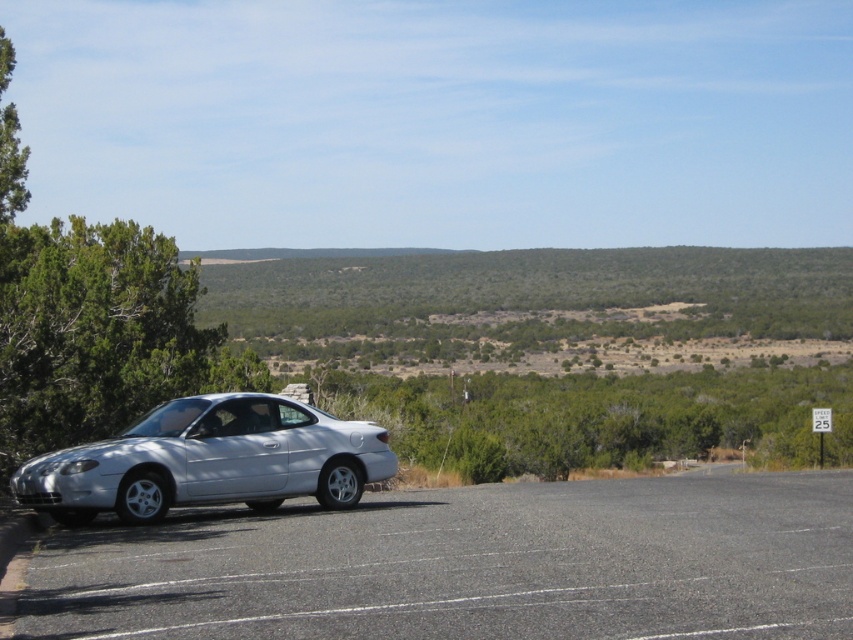
Question: Which object appears closest to the camera in this image?

Choices:
 (A) gray asphalt parking lot at lower left
 (B) satin silver car at left

Answer: (A)

Question: Can you confirm if gray asphalt parking lot at lower left is positioned to the left of satin silver car at left?

Choices:
 (A) yes
 (B) no

Answer: (B)

Question: Can you confirm if gray asphalt parking lot at lower left is positioned to the left of satin silver car at left?

Choices:
 (A) no
 (B) yes

Answer: (A)

Question: Is gray asphalt parking lot at lower left behind satin silver car at left?

Choices:
 (A) yes
 (B) no

Answer: (B)